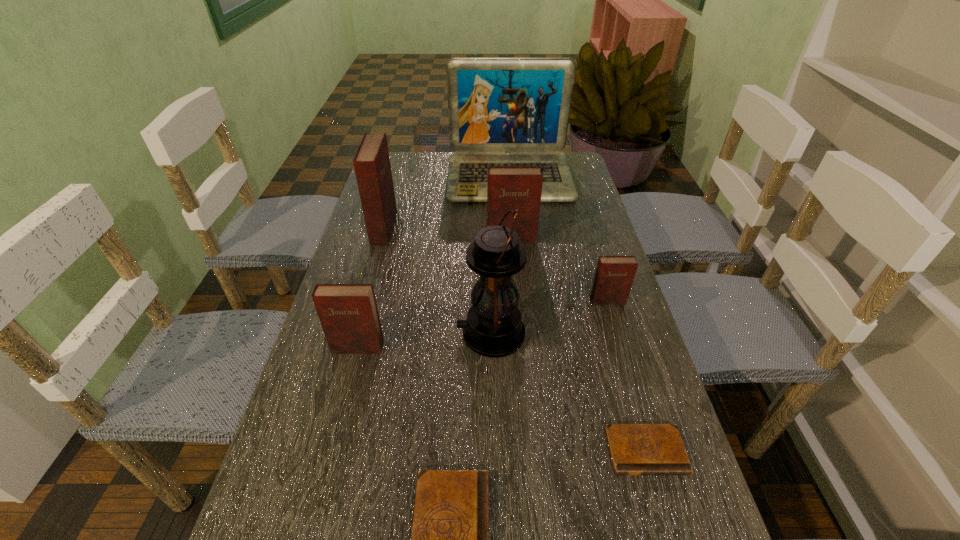
Locate an element on the screen. the smaller brown diary is located at coordinates (636, 449).

At what (x,y) coordinates should I click in order to perform the action: click on the shortest object. Please return your answer as a coordinate pair (x, y). Image resolution: width=960 pixels, height=540 pixels. Looking at the image, I should click on (636, 449).

Where is `vacant region located 0.140m on the screen of the laptop computer`? The image size is (960, 540). vacant region located 0.140m on the screen of the laptop computer is located at coordinates (515, 230).

Pinpoint the vacant space located above the lantern, indicating its light source. Please provide its 2D coordinates. Your answer should be formatted as a tuple, i.e. [(x, y)], where the tuple contains the x and y coordinates of a point satisfying the conditions above.

[(376, 334)]

Identify some points within the free space located above the lantern, indicating its light source. Please provide its 2D coordinates. Your answer should be formatted as a tuple, i.e. [(x, y)], where the tuple contains the x and y coordinates of a point satisfying the conditions above.

[(325, 334)]

Pinpoint the vacant space located 0.310m above the lantern, indicating its light source. Please provide its 2D coordinates. Your answer should be formatted as a tuple, i.e. [(x, y)], where the tuple contains the x and y coordinates of a point satisfying the conditions above.

[(325, 334)]

Where is `vacant position located on the front cover of the tallest diary`? vacant position located on the front cover of the tallest diary is located at coordinates (520, 228).

You are a GUI agent. You are given a task and a screenshot of the screen. Output one action in this format:
    pyautogui.click(x=<x>, y=<y>)
    Task: Click on the vacant space positioned on the front cover of the third reddish-brown diary from left to right
    Image resolution: width=960 pixels, height=540 pixels.
    Given the screenshot: What is the action you would take?
    click(515, 278)

At what (x,y) coordinates should I click in order to perform the action: click on free space located on the front cover of the third nearest diary. Please return your answer as a coordinate pair (x, y). The image size is (960, 540). Looking at the image, I should click on (314, 515).

Identify the location of free spot located on the front cover of the fourth tallest diary. (618, 335).